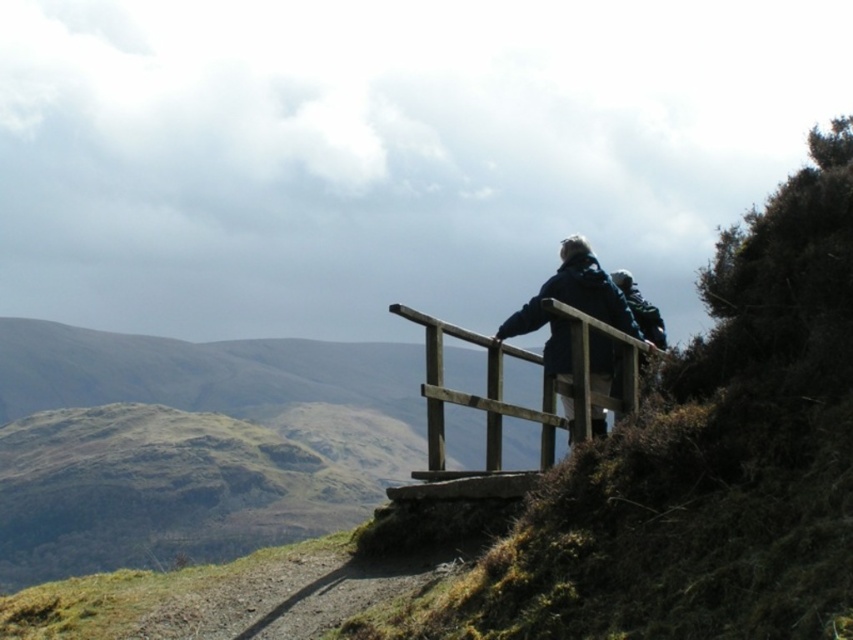
Question: Which point is farther to the camera?

Choices:
 (A) dark blue jacket at upper center
 (B) wooden rail at upper center

Answer: (A)

Question: Can you confirm if wooden rail at upper center is positioned above dark blue jacket at upper center?

Choices:
 (A) yes
 (B) no

Answer: (B)

Question: Is wooden rail at upper center to the left of dark blue jacket at upper center from the viewer's perspective?

Choices:
 (A) yes
 (B) no

Answer: (A)

Question: Does wooden rail at upper center appear over dark blue jacket at upper center?

Choices:
 (A) yes
 (B) no

Answer: (B)

Question: Which of the following is the closest to the observer?

Choices:
 (A) dark blue jacket at upper center
 (B) wooden rail at upper center

Answer: (B)